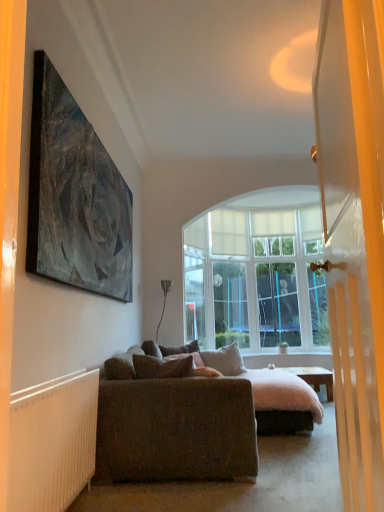
At what (x,y) coordinates should I click in order to perform the action: click on white sheer curtain at right. Please return your answer as a coordinate pair (x, y). The width and height of the screenshot is (384, 512). Looking at the image, I should click on pos(354,232).

Measure the distance between point (141, 357) and camera.

The depth of point (141, 357) is 11.34 feet.

This screenshot has width=384, height=512. In order to click on brown fabric pillow at center, positioned as the third pillow in back-to-front order in this screenshot , I will do `click(161, 367)`.

What do you see at coordinates (75, 196) in the screenshot? The height and width of the screenshot is (512, 384). I see `dark gray matte painting at upper left` at bounding box center [75, 196].

I want to click on dark gray matte painting at upper left, so click(x=75, y=196).

What is the approximate width of clear glass screen door at center?

2.93 inches.

At what (x,y) coordinates should I click in order to perform the action: click on white ribbed radiator at lower left. Please return your answer as a coordinate pair (x, y). The image size is (384, 512). Looking at the image, I should click on (52, 442).

What is the approximate height of white ribbed radiator at lower left?

27.11 inches.

Measure the distance between point (157, 338) and camera.

The distance of point (157, 338) from camera is 5.19 meters.

In order to click on textured brown couch at center in this screenshot , I will do `click(173, 420)`.

From the image's perspective, relative to white soft pillow at center, the 2th pillow positioned from the front, is brown fabric pillow at center, positioned as the third pillow in back-to-front order, above or below?

Based on their image positions, brown fabric pillow at center, positioned as the third pillow in back-to-front order, is located above white soft pillow at center, the 2th pillow positioned from the front.

How many degrees apart are the facing directions of brown fabric pillow at center, positioned as the third pillow in back-to-front order, and white soft pillow at center, the second pillow from the back?

The angle between the facing direction of brown fabric pillow at center, positioned as the third pillow in back-to-front order, and the facing direction of white soft pillow at center, the second pillow from the back, is 51.4 degrees.

Which of these two, brown fabric pillow at center, positioned as the third pillow in back-to-front order, or white soft pillow at center, the 2th pillow positioned from the front, is bigger?

Bigger between the two is white soft pillow at center, the 2th pillow positioned from the front.

From a real-world perspective, is brown fabric pillow at center, the first pillow when ordered from front to back, positioned above or below white soft pillow at center, the second pillow from the back?

Clearly, from a real-world perspective, brown fabric pillow at center, the first pillow when ordered from front to back, is above white soft pillow at center, the second pillow from the back.

From the image's perspective, is velvet purple pillow at center, placed as the third pillow when sorted from front to back, above clear glass screen door at center?

Incorrect, from the image's perspective, velvet purple pillow at center, placed as the third pillow when sorted from front to back, is lower than clear glass screen door at center.

Is velvet purple pillow at center, placed as the third pillow when sorted from front to back, bigger or smaller than clear glass screen door at center?

Considering their sizes, velvet purple pillow at center, placed as the third pillow when sorted from front to back, takes up less space than clear glass screen door at center.

Which object is thinner, velvet purple pillow at center, marked as the 1th pillow in a back-to-front arrangement, or clear glass screen door at center?

Thinner between the two is clear glass screen door at center.

Can you confirm if white sheer curtain at right is positioned to the right of dark gray matte painting at upper left?

Indeed, white sheer curtain at right is positioned on the right side of dark gray matte painting at upper left.

Does point (353, 186) come closer to viewer compared to point (84, 217)?

That is True.

Is white sheer curtain at right facing towards dark gray matte painting at upper left?

No, white sheer curtain at right is not facing towards dark gray matte painting at upper left.

Considering the relative sizes of metallic silver floor lamp at center and dark gray matte painting at upper left in the image provided, is metallic silver floor lamp at center bigger than dark gray matte painting at upper left?

No, metallic silver floor lamp at center is not bigger than dark gray matte painting at upper left.

From the image's perspective, is metallic silver floor lamp at center under dark gray matte painting at upper left?

Indeed, from the image's perspective, metallic silver floor lamp at center is shown beneath dark gray matte painting at upper left.

From a real-world perspective, who is located lower, metallic silver floor lamp at center or dark gray matte painting at upper left?

From a 3D spatial view, metallic silver floor lamp at center is below.

Is point (166, 285) less distant than point (58, 155)?

No, (166, 285) is further to viewer.

Is wooden desk at center at the back of velvet purple pillow at center, marked as the 1th pillow in a back-to-front arrangement?

No, wooden desk at center is not at the back of velvet purple pillow at center, marked as the 1th pillow in a back-to-front arrangement.

Considering the relative sizes of velvet purple pillow at center, placed as the third pillow when sorted from front to back, and wooden desk at center in the image provided, is velvet purple pillow at center, placed as the third pillow when sorted from front to back, shorter than wooden desk at center?

Indeed, velvet purple pillow at center, placed as the third pillow when sorted from front to back, has a lesser height compared to wooden desk at center.

In the scene shown: Based on their positions, is velvet purple pillow at center, marked as the 1th pillow in a back-to-front arrangement, located to the left or right of wooden desk at center?

velvet purple pillow at center, marked as the 1th pillow in a back-to-front arrangement, is to the left of wooden desk at center.

Is point (192, 346) closer to viewer compared to point (317, 391)?

Yes, it is in front of point (317, 391).

Which is in front, point (196, 345) or point (121, 469)?

The point (121, 469) is more forward.

From the image's perspective, is velvet purple pillow at center, placed as the third pillow when sorted from front to back, over textured brown couch at center?

Yes, from the image's perspective, velvet purple pillow at center, placed as the third pillow when sorted from front to back, is over textured brown couch at center.

Is velvet purple pillow at center, placed as the third pillow when sorted from front to back, at the left side of textured brown couch at center?

Yes, velvet purple pillow at center, placed as the third pillow when sorted from front to back, is to the left of textured brown couch at center.

Is white ribbed radiator at lower left far away from dark gray matte painting at upper left?

No, white ribbed radiator at lower left is in close proximity to dark gray matte painting at upper left.

Can you confirm if white ribbed radiator at lower left is wider than dark gray matte painting at upper left?

Correct, the width of white ribbed radiator at lower left exceeds that of dark gray matte painting at upper left.

Which of these two, white ribbed radiator at lower left or dark gray matte painting at upper left, is smaller?

Answer: With smaller size is white ribbed radiator at lower left.

The height and width of the screenshot is (512, 384). In order to click on pillow in front of the white soft pillow at center, the 2th pillow positioned from the front in this screenshot , I will do point(161,367).

I want to click on the 2nd pillow located beneath the clear glass screen door at center (from a real-world perspective), so click(180, 349).

Based on their spatial positions, is white soft pillow at center, the 2th pillow positioned from the front, or dark gray matte painting at upper left further from green leafy plant at center?

Based on the image, dark gray matte painting at upper left appears to be further to green leafy plant at center.

Looking at the image, which one is located closer to wooden desk at center, white sheer curtain at right or dark gray matte painting at upper left?

Among the two, dark gray matte painting at upper left is located nearer to wooden desk at center.

Estimate the real-world distances between objects in this image. Which object is closer to wooden desk at center, green leafy plant at center or white soft pillow at center, the second pillow from the back?

white soft pillow at center, the second pillow from the back, lies closer to wooden desk at center than the other object.

When comparing their distances from velvet purple pillow at center, placed as the third pillow when sorted from front to back, does white soft pillow at center, the 2th pillow positioned from the front, or textured brown couch at center seem further?

textured brown couch at center lies further to velvet purple pillow at center, placed as the third pillow when sorted from front to back, than the other object.

Considering their positions, is white sheer curtain at right positioned further to brown fabric pillow at center, the first pillow when ordered from front to back, than green leafy plant at center?

green leafy plant at center.

Considering their positions, is velvet purple pillow at center, marked as the 1th pillow in a back-to-front arrangement, positioned further to brown fabric pillow at center, positioned as the third pillow in back-to-front order, than white soft pillow at center, the 2th pillow positioned from the front?

The object further to brown fabric pillow at center, positioned as the third pillow in back-to-front order, is white soft pillow at center, the 2th pillow positioned from the front.

From the image, which object appears to be nearer to metallic silver floor lamp at center, velvet purple pillow at center, placed as the third pillow when sorted from front to back, or brown fabric pillow at center, positioned as the third pillow in back-to-front order?

The object closer to metallic silver floor lamp at center is velvet purple pillow at center, placed as the third pillow when sorted from front to back.

Looking at this image, based on their spatial positions, is green leafy plant at center or white soft pillow at center, the 2th pillow positioned from the front, closer to white sheer curtain at right?

white soft pillow at center, the 2th pillow positioned from the front, lies closer to white sheer curtain at right than the other object.

At what (x,y) coordinates should I click in order to perform the action: click on picture frame positioned between white sheer curtain at right and brown fabric pillow at center, the first pillow when ordered from front to back, from near to far. Please return your answer as a coordinate pair (x, y). This screenshot has width=384, height=512. Looking at the image, I should click on (75, 196).

Locate an element on the screen. The height and width of the screenshot is (512, 384). studio couch between white ribbed radiator at lower left and clear glass screen door at center from front to back is located at coordinates (173, 420).

The image size is (384, 512). Find the location of `desk between velvet purple pillow at center, marked as the 1th pillow in a back-to-front arrangement, and green leafy plant at center from front to back`. desk between velvet purple pillow at center, marked as the 1th pillow in a back-to-front arrangement, and green leafy plant at center from front to back is located at coordinates (315, 378).

What are the coordinates of `lamp located between brown fabric pillow at center, the first pillow when ordered from front to back, and clear glass screen door at center in the depth direction` in the screenshot? It's located at (164, 301).